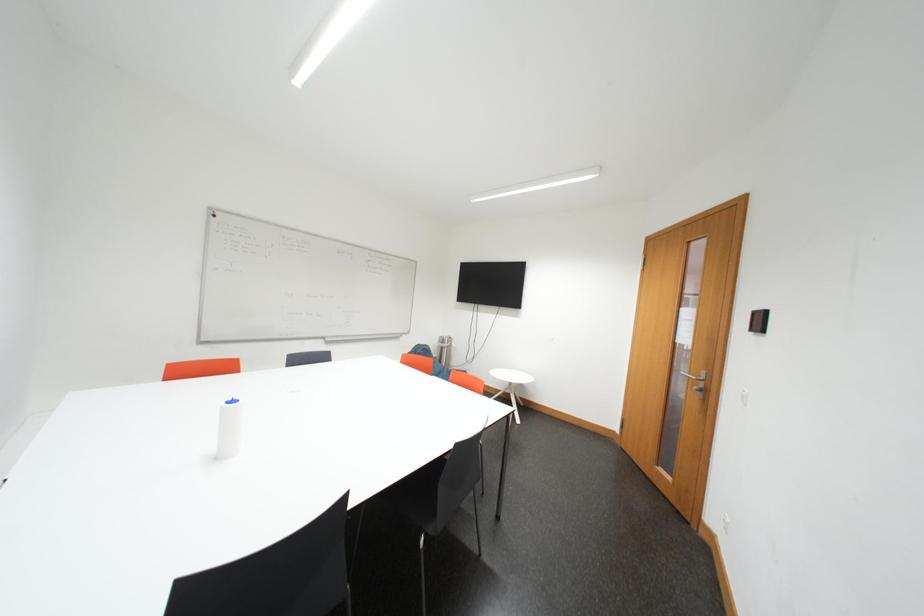
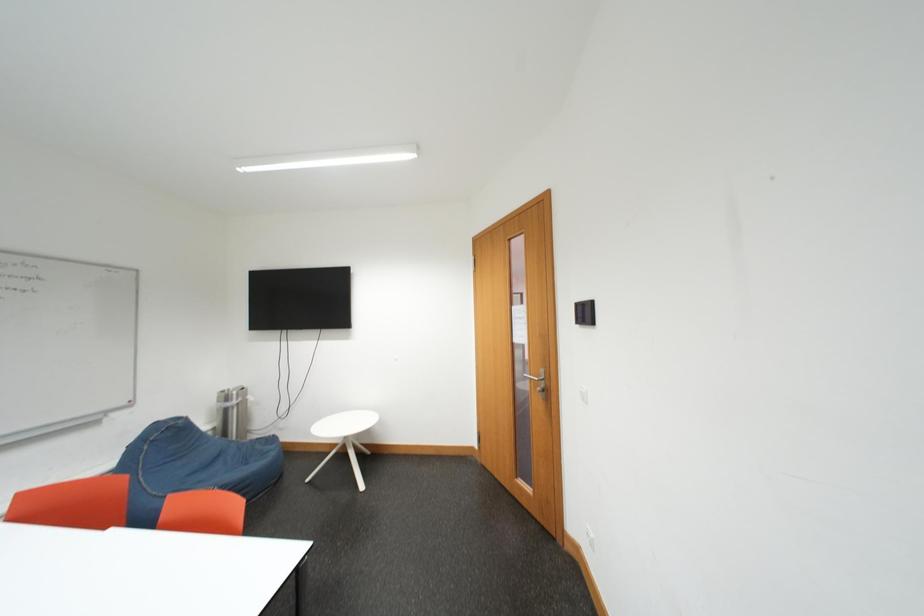
Question: How did the camera likely rotate?

Choices:
 (A) Left
 (B) Right
 (C) Up
 (D) Down

Answer: (B)